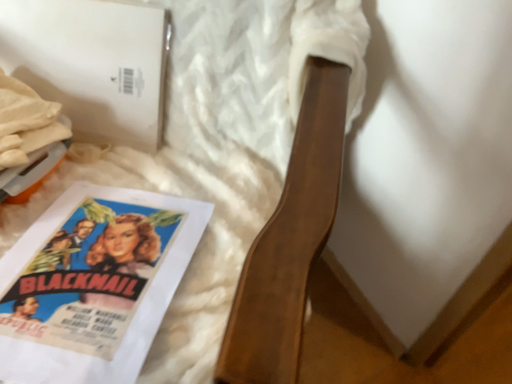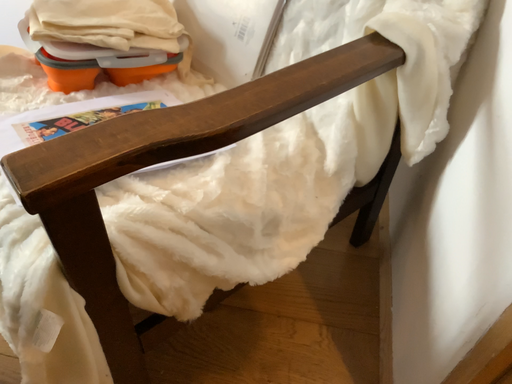
Question: Which way did the camera rotate in the video?

Choices:
 (A) rotated upward
 (B) rotated downward

Answer: (A)